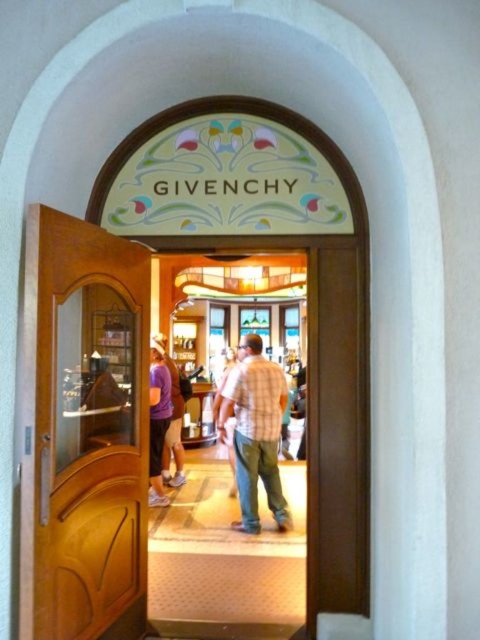
You are a customer in a store and see the plaid shirt at center and the purple fabric pants at center displayed in the window of the GIVENCHY doorway. If you want to grab the item that is on the left side of the display, which one should you choose?

The purple fabric pants at center are on the left side of the display since the plaid shirt at center is to the right of them.

You are a delivery person trying to enter the store through the wooden door at left. The plaid shirt at center is hanging on a rack blocking the doorway. Can you walk through the doorway without bending down?

The wooden door at left is taller than plaid shirt at center, so the doorway is tall enough to walk through without bending down.

You are standing in front of the arched doorway with the GIVENCHY sign above it. You need to locate the wooden door at left. Where exactly is it positioned relative to the GIVENCHY sign?

The wooden door at left is positioned at point (83, 438) relative to the GIVENCHY sign.